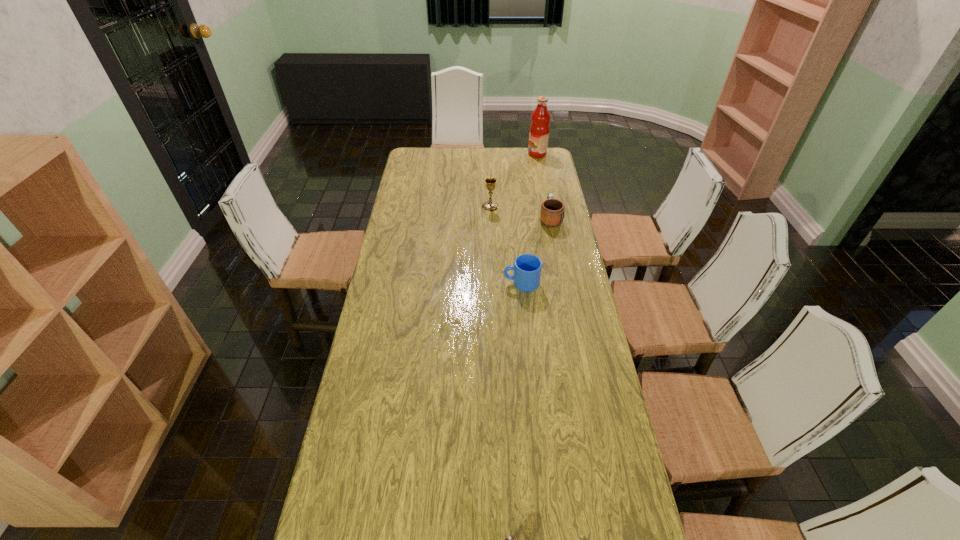
You are a GUI agent. You are given a task and a screenshot of the screen. Output one action in this format:
    pyautogui.click(x=<x>, y=<y>)
    Task: Click on the free location located 0.290m on the side of the nearer mug with the handle
    Image resolution: width=960 pixels, height=540 pixels.
    Given the screenshot: What is the action you would take?
    pyautogui.click(x=425, y=283)

I want to click on vacant space situated 0.190m on the side of the nearer mug with the handle, so click(452, 283).

Find the location of a particular element. blank space located on the side of the nearer mug with the handle is located at coordinates (399, 283).

Image resolution: width=960 pixels, height=540 pixels. Identify the location of blank area located on the side of the right mug with the handle. (544, 191).

The height and width of the screenshot is (540, 960). Find the location of `blank space located on the side of the right mug with the handle`. blank space located on the side of the right mug with the handle is located at coordinates (541, 172).

Where is `vacant space located on the side of the right mug with the handle`? Image resolution: width=960 pixels, height=540 pixels. vacant space located on the side of the right mug with the handle is located at coordinates (544, 191).

At what (x,y) coordinates should I click in order to perform the action: click on object that is at the far edge. Please return your answer as a coordinate pair (x, y). The width and height of the screenshot is (960, 540). Looking at the image, I should click on (539, 129).

The width and height of the screenshot is (960, 540). I want to click on fruit juice present at the right edge, so click(x=539, y=129).

Where is `object positioned at the far right corner`? object positioned at the far right corner is located at coordinates (539, 129).

Where is `vacant space at the left edge of the desktop`? The width and height of the screenshot is (960, 540). vacant space at the left edge of the desktop is located at coordinates (414, 180).